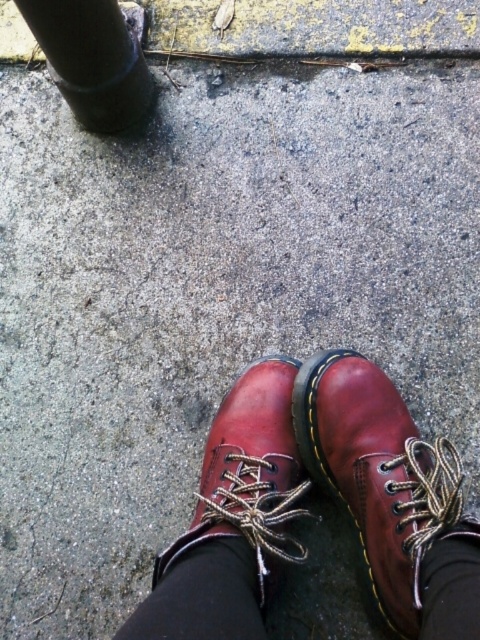
Which is in front, point (107, 124) or point (119, 630)?

Point (119, 630)

Does black matte pole at upper left have a greater height compared to black fabric sock at lower center?

Correct, black matte pole at upper left is much taller as black fabric sock at lower center.

Measure the distance between black matte pole at upper left and camera.

A distance of 98.40 centimeters exists between black matte pole at upper left and camera.

Find the location of a particular element. black matte pole at upper left is located at coordinates (93, 60).

Does shiny leather boots at center appear on the right side of black fabric sock at lower center?

Yes, shiny leather boots at center is to the right of black fabric sock at lower center.

Measure the distance between shiny leather boots at center and camera.

24.83 inches

Does point (375, 499) lie behind point (172, 593)?

Yes, it is behind point (172, 593).

In order to click on shiny leather boots at center in this screenshot , I will do `click(308, 513)`.

Is shiny brown leather shoe at center to the right of black matte pole at upper left from the viewer's perspective?

Indeed, shiny brown leather shoe at center is positioned on the right side of black matte pole at upper left.

Who is more forward, (408, 556) or (120, 70)?

Positioned in front is point (408, 556).

The width and height of the screenshot is (480, 640). Identify the location of shiny brown leather shoe at center. (380, 474).